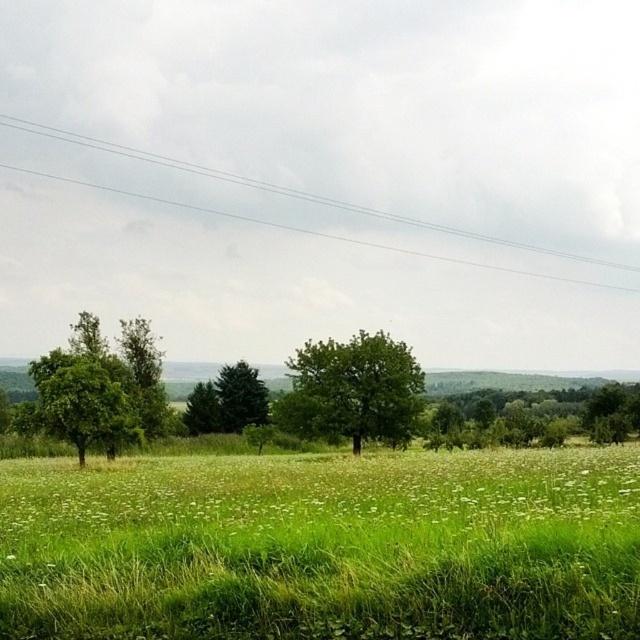
Question: Considering the real-world distances, which object is farthest from the green leafy tree at left?

Choices:
 (A) clear wire at upper center
 (B) green leafy tree at center

Answer: (A)

Question: Which point appears closest to the camera in this image?

Choices:
 (A) tap(84, 404)
 (B) tap(456, 401)
 (C) tap(372, 396)
 (D) tap(93, 481)

Answer: (D)

Question: Is green leafy tree at left positioned at the back of green leafy tree at center?

Choices:
 (A) yes
 (B) no

Answer: (B)

Question: Which point appears farthest from the camera in this image?

Choices:
 (A) (342, 460)
 (B) (292, 189)
 (C) (349, 355)
 (D) (598, 406)

Answer: (B)

Question: Can you confirm if green leafy tree at center is wider than green leafy tree at right?

Choices:
 (A) yes
 (B) no

Answer: (B)

Question: Where is green leafy tree at left located in relation to green leafy tree at right in the image?

Choices:
 (A) above
 (B) below

Answer: (A)